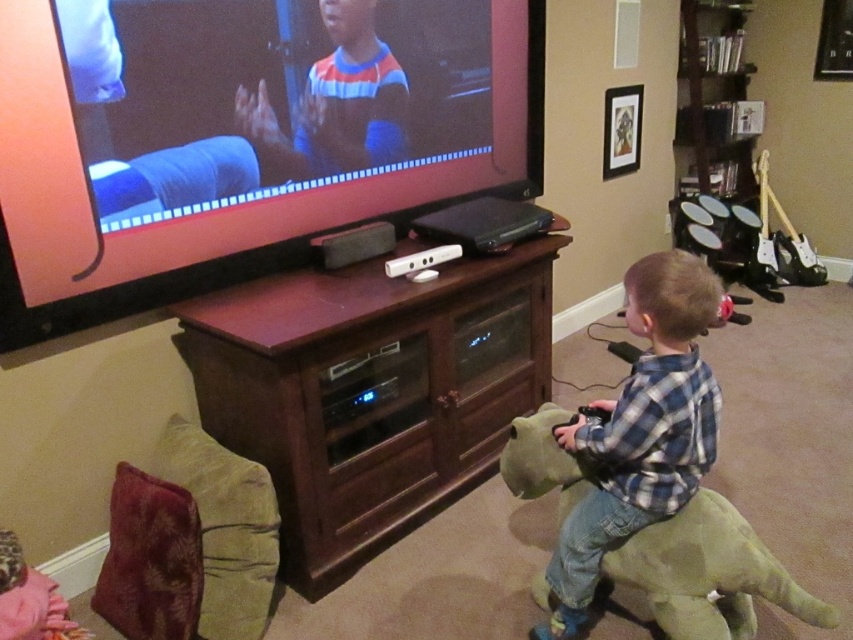
You are a photographer taking a picture of the scene. The point at coordinates (640, 432) marks the location of the blue plaid shirt at lower right. If you want to ensure both the child and the gaming controller are in focus, where should you position your camera focus? Please provide the coordinates as a pair of numbers between 0 and 1, separated by a comma.

The point at coordinates (640, 432) marks the location of the blue plaid shirt at lower right. To ensure both the child and the gaming controller are in focus, you should position the camera focus at the midpoint between the child and the gaming controller. However, since the provided coordinates specifically indicate the blue plaid shirt at lower right, the focus should be placed there to prioritize the child, who is wearing it, ensuring the main subject remains sharp.

You are a parent trying to retrieve the remote control from the brown wood entertainment center at center while your child is sitting on the green plush dinosaur at lower right. Can you reach the remote without disturbing the child?

The brown wood entertainment center at center and green plush dinosaur at lower right are 24.04 inches apart. Since the distance between them is sufficient, you can reach the remote control from the brown wood entertainment center at center without disturbing the child sitting on the green plush dinosaur at lower right.

Consider the image. Please look at the scene described. There is a point marked at coordinates (370, 392). What object is located at that point?

The point at coordinates (370, 392) marks the brown wood entertainment center at center.